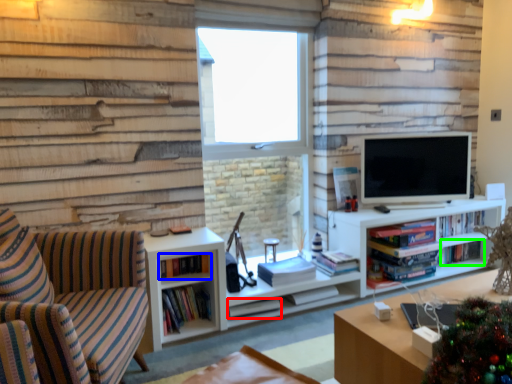
Question: Which object is the farthest from book (highlighted by a red box)? Choose among these: book (highlighted by a blue box) or book (highlighted by a green box).

Choices:
 (A) book
 (B) book

Answer: (B)